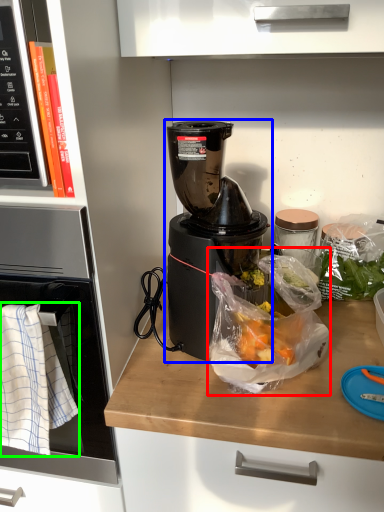
Question: Which is nearer to the plastic bag (highlighted by a red box)? blender (highlighted by a blue box) or cloth (highlighted by a green box).

Choices:
 (A) blender
 (B) cloth

Answer: (A)